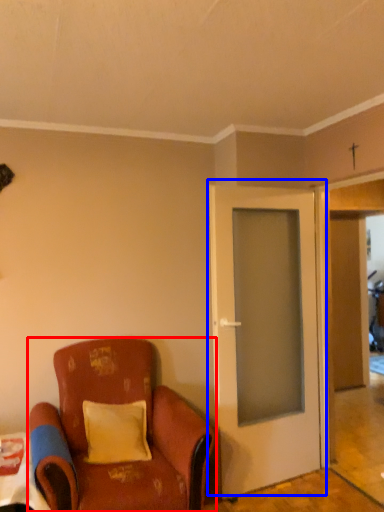
Question: Among these objects, which one is nearest to the camera, chair (highlighted by a red box) or door (highlighted by a blue box)?

Choices:
 (A) chair
 (B) door

Answer: (A)